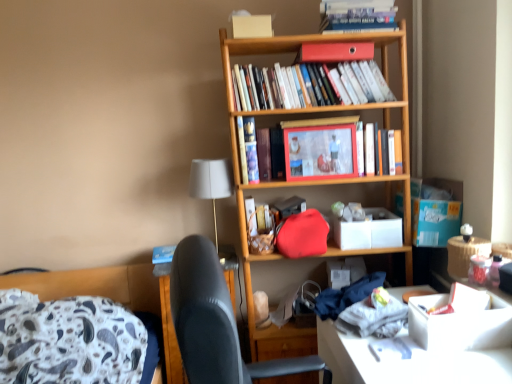
Question: In terms of size, does blue cardboard box at right, the second cardboard box positioned from the left, appear bigger or smaller than hardcover book at upper center, arranged as the first book when viewed from the top?

Choices:
 (A) small
 (B) big

Answer: (B)

Question: Considering the relative positions of blue cardboard box at right, the second cardboard box positioned from the left, and hardcover book at upper center, the fourth book ordered from the bottom, in the image provided, is blue cardboard box at right, the second cardboard box positioned from the left, to the left or to the right of hardcover book at upper center, the fourth book ordered from the bottom,?

Choices:
 (A) left
 (B) right

Answer: (B)

Question: Which object is positioned farthest from the matte red book at upper center?

Choices:
 (A) hardcover book at center, the 1th book from the bottom
 (B) hardcover book at upper center, arranged as the first book when viewed from the top
 (C) white cardboard box at lower right
 (D) matte red handbag at center
 (E) wooden picture frame at center

Answer: (C)

Question: Estimate the real-world distances between objects in this image. Which object is closer to the hardcover book at center, the 3th book positioned from the top?

Choices:
 (A) matte red handbag at center
 (B) hardcover book at upper center, the fourth book ordered from the bottom
 (C) hardcover books at upper center, placed as the 3th book when sorted from bottom to top
 (D) wooden picture frame at center
 (E) white fabric lampshade at upper center

Answer: (E)